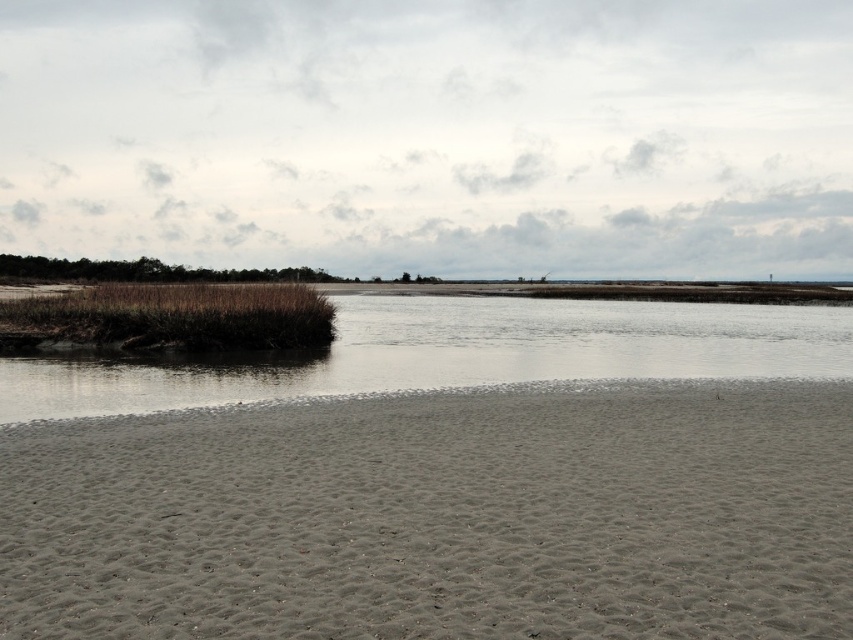
This screenshot has height=640, width=853. What are the coordinates of `gray sandy beach at lower center` in the screenshot? It's located at (439, 516).

Locate an element on the screen. Image resolution: width=853 pixels, height=640 pixels. gray sandy beach at lower center is located at coordinates (439, 516).

Who is positioned more to the left, gray sandy beach at lower center or brown matte water at center?

Positioned to the left is gray sandy beach at lower center.

Between point (723, 472) and point (303, 369), which one is positioned behind?

Point (303, 369)

Identify the location of gray sandy beach at lower center. (439, 516).

Which is behind, point (497, 378) or point (120, 289)?

Positioned behind is point (120, 289).

Who is higher up, brown matte water at center or brown grassy wetland at left?

brown matte water at center is above.

Identify the location of brown matte water at center. (457, 353).

The image size is (853, 640). What are the coordinates of `brown matte water at center` in the screenshot? It's located at (457, 353).